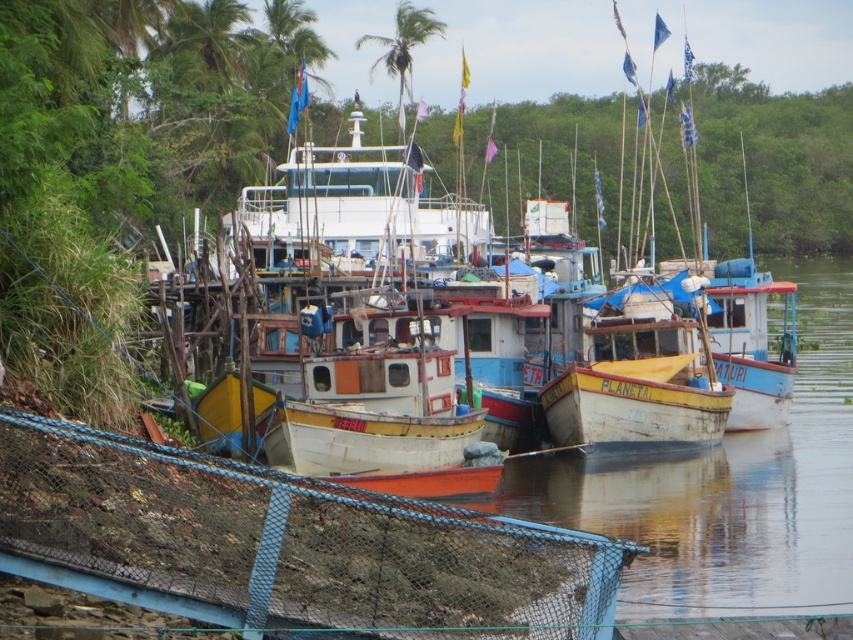
Question: Is blue mesh net at lower left further to camera compared to green leafy palm tree at upper center?

Choices:
 (A) no
 (B) yes

Answer: (A)

Question: Among these objects, which one is farthest from the camera?

Choices:
 (A) blue mesh net at lower left
 (B) green leafy palm tree at upper center

Answer: (B)

Question: Does blue mesh net at lower left have a larger size compared to green leafy palm tree at upper center?

Choices:
 (A) yes
 (B) no

Answer: (B)

Question: Among these objects, which one is farthest from the camera?

Choices:
 (A) green leafy palm tree at upper center
 (B) blue mesh net at lower left

Answer: (A)

Question: Which of the following is the farthest from the observer?

Choices:
 (A) (405, 52)
 (B) (397, 513)

Answer: (A)

Question: Observing the image, what is the correct spatial positioning of blue mesh net at lower left in reference to green leafy palm tree at upper center?

Choices:
 (A) right
 (B) left

Answer: (A)